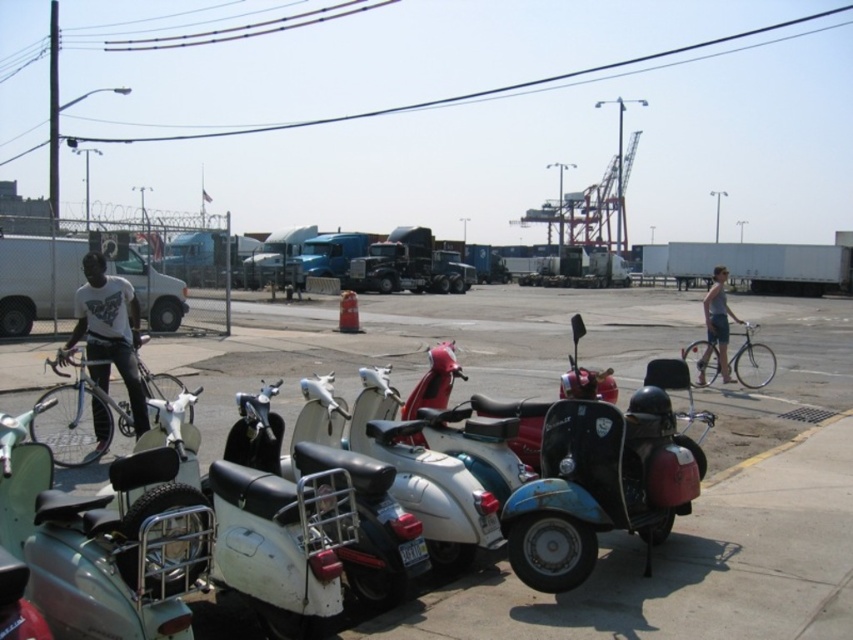
You are a delivery person who needs to place the silver metallic bicycle at right onto the smooth concrete pavement at center. Is the bicycle already positioned on the pavement?

The smooth concrete pavement at center is located below the silver metallic bicycle at right, which means the bicycle is already placed on the pavement.

You are a delivery person who needs to load a package onto the metallic silver scooter at lower left. The package requires at least 1.5 meters of vertical clearance. Can the scooter accommodate the package based on its height compared to the white matte shirt at center?

The metallic silver scooter at lower left is shorter than the white matte shirt at center. Since the shirt is on a person, we can estimate the scooter is under average human height. Assuming the average person is about 1.7 meters tall, the scooter is likely shorter than 1.7 meters. Therefore, the 1.5 meters required for the package may not be met, so the scooter might not accommodate the package.